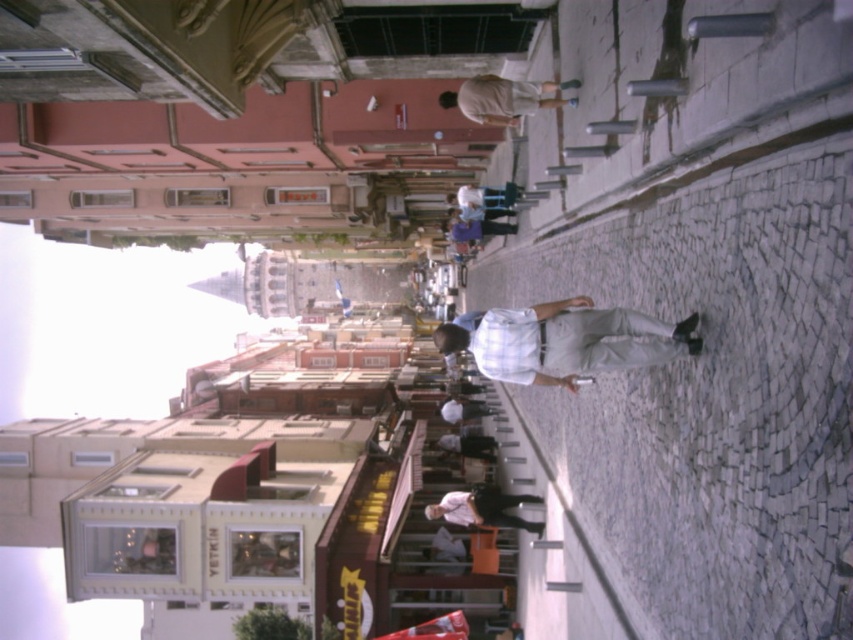
You are a delivery person who needs to place a package on the light brown wooden skateboard at center. However, there is a white shirt at center in the way. Can you place the package on the skateboard without moving the shirt?

The light brown wooden skateboard at center is much taller than the white shirt at center, so you can place the package on top of the skateboard without needing to move the shirt.

You are a delivery person who needs to pick up a package from the light brown wooden skateboard at center. However, there is a white shirt at center in the way. Can you easily access the skateboard without moving the shirt?

The light brown wooden skateboard at center is positioned over the white shirt at center, meaning the skateboard is above the shirt. Since the skateboard is above the shirt, you can easily access it without needing to move the shirt.